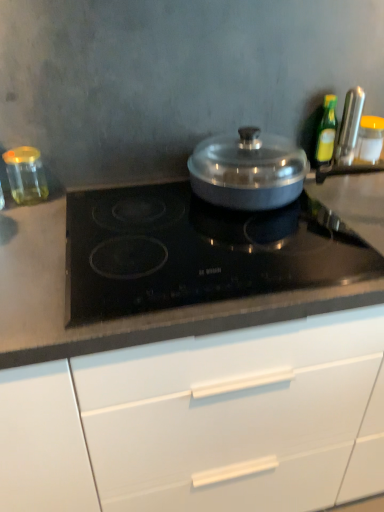
What do you see at coordinates (202, 422) in the screenshot?
I see `white matte cabinet at center` at bounding box center [202, 422].

The width and height of the screenshot is (384, 512). Find the location of `white matte cabinet at center`. white matte cabinet at center is located at coordinates (202, 422).

Where is `green glass bottle at upper right, marked as the second kitchen appliance in a left-to-right arrangement`? The height and width of the screenshot is (512, 384). green glass bottle at upper right, marked as the second kitchen appliance in a left-to-right arrangement is located at coordinates (326, 132).

What do you see at coordinates (370, 139) in the screenshot? The height and width of the screenshot is (512, 384). I see `yellow lid glass jar at right, which ranks as the first kitchen appliance in right-to-left order` at bounding box center [370, 139].

Locate an element on the screen. This screenshot has height=512, width=384. black glass cooktop at center is located at coordinates (174, 267).

Locate an element on the screen. white matte cabinet at center is located at coordinates (202, 422).

From a real-world perspective, is green glass bottle at upper right, positioned as the 3th kitchen appliance in right-to-left order, physically above black glass cooktop at center?

Yes, from a real-world perspective, green glass bottle at upper right, positioned as the 3th kitchen appliance in right-to-left order, is on top of black glass cooktop at center.

Does green glass bottle at upper right, positioned as the 3th kitchen appliance in right-to-left order, lie behind black glass cooktop at center?

Yes, it is.

Is green glass bottle at upper right, positioned as the 3th kitchen appliance in right-to-left order, surrounding black glass cooktop at center?

No, black glass cooktop at center is not inside green glass bottle at upper right, positioned as the 3th kitchen appliance in right-to-left order.

Is transparent glass jar at left, the first kitchen appliance in the left-to-right sequence, next to green glass bottle at upper right, positioned as the 3th kitchen appliance in right-to-left order, and touching it?

transparent glass jar at left, the first kitchen appliance in the left-to-right sequence, is not next to green glass bottle at upper right, positioned as the 3th kitchen appliance in right-to-left order, and they're not touching.

Is point (24, 200) closer or farther from the camera than point (329, 140)?

Clearly, point (24, 200) is closer to the camera than point (329, 140).

From a real-world perspective, which kitchen appliance is the 2nd one underneath the green glass bottle at upper right, positioned as the 3th kitchen appliance in right-to-left order? Please provide its 2D coordinates.

[(26, 175)]

Consider the image. Considering the relative positions of transparent glass jar at left, the first kitchen appliance in the left-to-right sequence, and green glass bottle at upper right, marked as the second kitchen appliance in a left-to-right arrangement, in the image provided, is transparent glass jar at left, the first kitchen appliance in the left-to-right sequence, behind green glass bottle at upper right, marked as the second kitchen appliance in a left-to-right arrangement,?

No, the depth of transparent glass jar at left, the first kitchen appliance in the left-to-right sequence, is less than that of green glass bottle at upper right, marked as the second kitchen appliance in a left-to-right arrangement.

From the image's perspective, which is below, metallic silver knife at upper right, which is counted as the third kitchen appliance, starting from the left, or yellow lid glass jar at right, which ranks as the first kitchen appliance in right-to-left order?

yellow lid glass jar at right, which ranks as the first kitchen appliance in right-to-left order, is shown below in the image.

Does metallic silver knife at upper right, the 2th kitchen appliance viewed from the right, turn towards yellow lid glass jar at right, the 4th kitchen appliance viewed from the left?

No, metallic silver knife at upper right, the 2th kitchen appliance viewed from the right, is not facing towards yellow lid glass jar at right, the 4th kitchen appliance viewed from the left.

Is metallic silver knife at upper right, the 2th kitchen appliance viewed from the right, further to camera compared to yellow lid glass jar at right, the 4th kitchen appliance viewed from the left?

No, metallic silver knife at upper right, the 2th kitchen appliance viewed from the right, is closer to the viewer.

From a real-world perspective, is white matte cabinet at center physically located above or below yellow lid glass jar at right, which ranks as the first kitchen appliance in right-to-left order?

In terms of real-world spatial position, white matte cabinet at center is below yellow lid glass jar at right, which ranks as the first kitchen appliance in right-to-left order.

From the picture: What's the angular difference between white matte cabinet at center and yellow lid glass jar at right, which ranks as the first kitchen appliance in right-to-left order,'s facing directions?

The angular difference between white matte cabinet at center and yellow lid glass jar at right, which ranks as the first kitchen appliance in right-to-left order, is 0.0432 degrees.

Where is `cabinetry lying in front of the yellow lid glass jar at right, which ranks as the first kitchen appliance in right-to-left order`? This screenshot has width=384, height=512. cabinetry lying in front of the yellow lid glass jar at right, which ranks as the first kitchen appliance in right-to-left order is located at coordinates (202, 422).

Is white matte cabinet at center positioned beyond the bounds of yellow lid glass jar at right, which ranks as the first kitchen appliance in right-to-left order?

That's correct, white matte cabinet at center is outside of yellow lid glass jar at right, which ranks as the first kitchen appliance in right-to-left order.

From the image's perspective, count 4th kitchen appliances upward from the white matte cabinet at center and point to it. Please provide its 2D coordinates.

[(326, 132)]

Is point (325, 99) less distant than point (159, 397)?

No, it is not.

From a real-world perspective, is green glass bottle at upper right, positioned as the 3th kitchen appliance in right-to-left order, on top of white matte cabinet at center?

Yes.

Can you confirm if green glass bottle at upper right, marked as the second kitchen appliance in a left-to-right arrangement, is shorter than white matte cabinet at center?

Yes, green glass bottle at upper right, marked as the second kitchen appliance in a left-to-right arrangement, is shorter than white matte cabinet at center.

Which of these two, white matte cabinet at center or black glass cooktop at center, stands taller?

Standing taller between the two is white matte cabinet at center.

Considering the positions of objects white matte cabinet at center and black glass cooktop at center in the image provided, who is in front, white matte cabinet at center or black glass cooktop at center?

white matte cabinet at center is closer to the camera.

From a real-world perspective, is white matte cabinet at center under black glass cooktop at center?

Yes, from a real-world perspective, white matte cabinet at center is beneath black glass cooktop at center.

Relative to black glass cooktop at center, is transparent glass jar at left, the first kitchen appliance in the left-to-right sequence, in front or behind?

Visually, transparent glass jar at left, the first kitchen appliance in the left-to-right sequence, is located behind black glass cooktop at center.

Do you think transparent glass jar at left, the first kitchen appliance in the left-to-right sequence, is within black glass cooktop at center, or outside of it?

transparent glass jar at left, the first kitchen appliance in the left-to-right sequence, cannot be found inside black glass cooktop at center.

From the picture: From a real-world perspective, is transparent glass jar at left, arranged as the fourth kitchen appliance when viewed from the right, above or below black glass cooktop at center?

transparent glass jar at left, arranged as the fourth kitchen appliance when viewed from the right, is situated higher than black glass cooktop at center in the real world.

Where is `countertop that appears below the green glass bottle at upper right, marked as the second kitchen appliance in a left-to-right arrangement (from a real-world perspective)`? The image size is (384, 512). countertop that appears below the green glass bottle at upper right, marked as the second kitchen appliance in a left-to-right arrangement (from a real-world perspective) is located at coordinates [174, 267].

This screenshot has width=384, height=512. I want to click on the 2nd kitchen appliance in front of the green glass bottle at upper right, marked as the second kitchen appliance in a left-to-right arrangement, starting your count from the anchor, so click(x=26, y=175).

Considering their positions, is green glass bottle at upper right, marked as the second kitchen appliance in a left-to-right arrangement, positioned closer to black glass cooktop at center than white matte cabinet at center?

Among the two, white matte cabinet at center is located nearer to black glass cooktop at center.

Looking at the image, which one is located further to transparent glass jar at left, arranged as the fourth kitchen appliance when viewed from the right, black glass cooktop at center or green glass bottle at upper right, positioned as the 3th kitchen appliance in right-to-left order?

The object further to transparent glass jar at left, arranged as the fourth kitchen appliance when viewed from the right, is green glass bottle at upper right, positioned as the 3th kitchen appliance in right-to-left order.

Which object lies further to the anchor point yellow lid glass jar at right, which ranks as the first kitchen appliance in right-to-left order, metallic silver knife at upper right, the 2th kitchen appliance viewed from the right, or transparent glass jar at left, the first kitchen appliance in the left-to-right sequence?

transparent glass jar at left, the first kitchen appliance in the left-to-right sequence, lies further to yellow lid glass jar at right, which ranks as the first kitchen appliance in right-to-left order, than the other object.

From the image, which object appears to be nearer to metallic silver knife at upper right, which is counted as the third kitchen appliance, starting from the left, white matte cabinet at center or green glass bottle at upper right, marked as the second kitchen appliance in a left-to-right arrangement?

The object closer to metallic silver knife at upper right, which is counted as the third kitchen appliance, starting from the left, is green glass bottle at upper right, marked as the second kitchen appliance in a left-to-right arrangement.

Consider the image. Considering their positions, is transparent glass jar at left, arranged as the fourth kitchen appliance when viewed from the right, positioned closer to white matte cabinet at center than black glass cooktop at center?

black glass cooktop at center is positioned closer to the anchor white matte cabinet at center.

Which object lies nearer to the anchor point yellow lid glass jar at right, the 4th kitchen appliance viewed from the left, black glass cooktop at center or green glass bottle at upper right, positioned as the 3th kitchen appliance in right-to-left order?

green glass bottle at upper right, positioned as the 3th kitchen appliance in right-to-left order.

Which object lies nearer to the anchor point yellow lid glass jar at right, the 4th kitchen appliance viewed from the left, white matte cabinet at center or black glass cooktop at center?

black glass cooktop at center.

When comparing their distances from metallic silver knife at upper right, the 2th kitchen appliance viewed from the right, does green glass bottle at upper right, marked as the second kitchen appliance in a left-to-right arrangement, or yellow lid glass jar at right, the 4th kitchen appliance viewed from the left, seem further?

yellow lid glass jar at right, the 4th kitchen appliance viewed from the left.

Find the location of a particular element. countertop between transparent glass jar at left, the first kitchen appliance in the left-to-right sequence, and metallic silver knife at upper right, which is counted as the third kitchen appliance, starting from the left, from left to right is located at coordinates click(x=174, y=267).

What are the coordinates of `kitchen appliance between transparent glass jar at left, arranged as the fourth kitchen appliance when viewed from the right, and metallic silver knife at upper right, which is counted as the third kitchen appliance, starting from the left, in the horizontal direction` in the screenshot? It's located at (326, 132).

You are a GUI agent. You are given a task and a screenshot of the screen. Output one action in this format:
    pyautogui.click(x=<x>, y=<y>)
    Task: Click on the countertop that lies between green glass bottle at upper right, positioned as the 3th kitchen appliance in right-to-left order, and white matte cabinet at center from top to bottom
    The image size is (384, 512).
    Given the screenshot: What is the action you would take?
    pyautogui.click(x=174, y=267)

Locate an element on the screen. countertop between metallic silver knife at upper right, which is counted as the third kitchen appliance, starting from the left, and white matte cabinet at center from top to bottom is located at coordinates (174, 267).